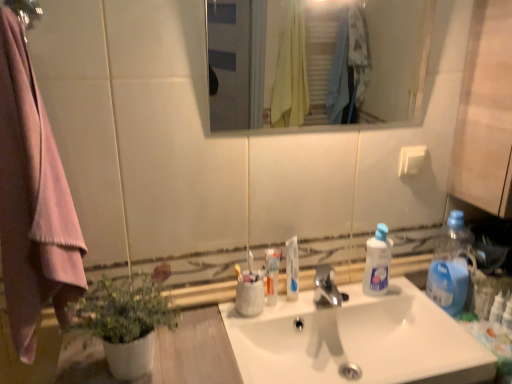
I want to click on vacant area located to the right-hand side of satin nickel faucet at center, so click(382, 300).